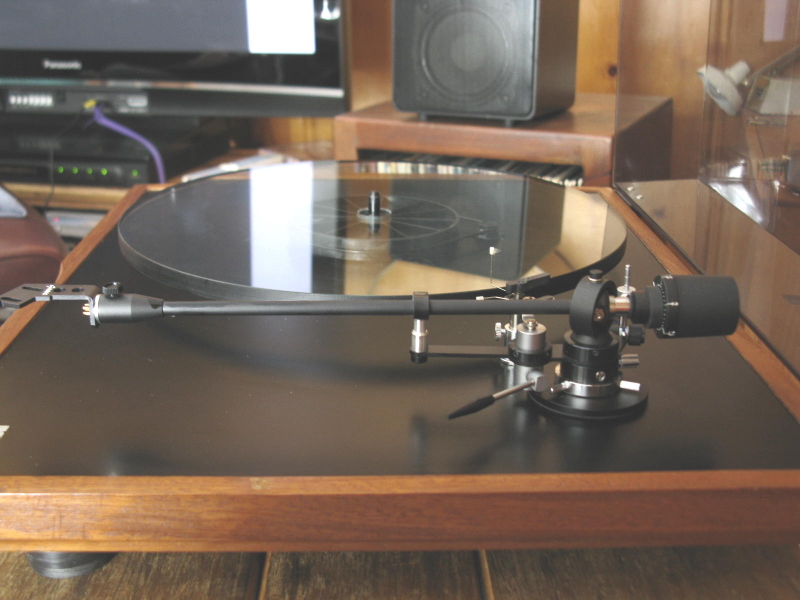
Identify the location of leather seat. This screenshot has width=800, height=600. (28, 247).